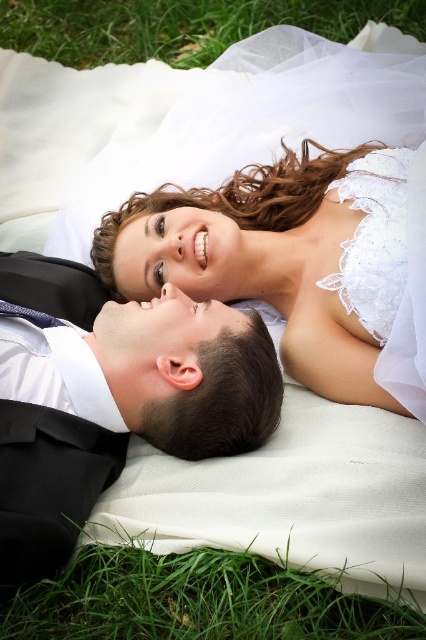
Question: Among these objects, which one is farthest from the camera?

Choices:
 (A) lace white dress at upper center
 (B) black satin suit at upper left
 (C) green grass at upper left

Answer: (C)

Question: Which point appears closest to the camera in this image?

Choices:
 (A) (49, 26)
 (B) (25, 348)
 (C) (172, 611)
 (D) (356, 227)

Answer: (C)

Question: In this image, where is green grass at upper left located relative to lace white dress at upper center?

Choices:
 (A) below
 (B) above

Answer: (B)

Question: Observing the image, what is the correct spatial positioning of black satin suit at upper left in reference to lace white dress at upper center?

Choices:
 (A) below
 (B) above

Answer: (A)

Question: Observing the image, what is the correct spatial positioning of black satin suit at upper left in reference to green grass at lower left?

Choices:
 (A) left
 (B) right

Answer: (A)

Question: Estimate the real-world distances between objects in this image. Which object is farther from the green grass at lower left?

Choices:
 (A) white lace dress at upper center
 (B) lace white dress at upper center
 (C) green grass at upper left
 (D) black satin suit at upper left

Answer: (C)